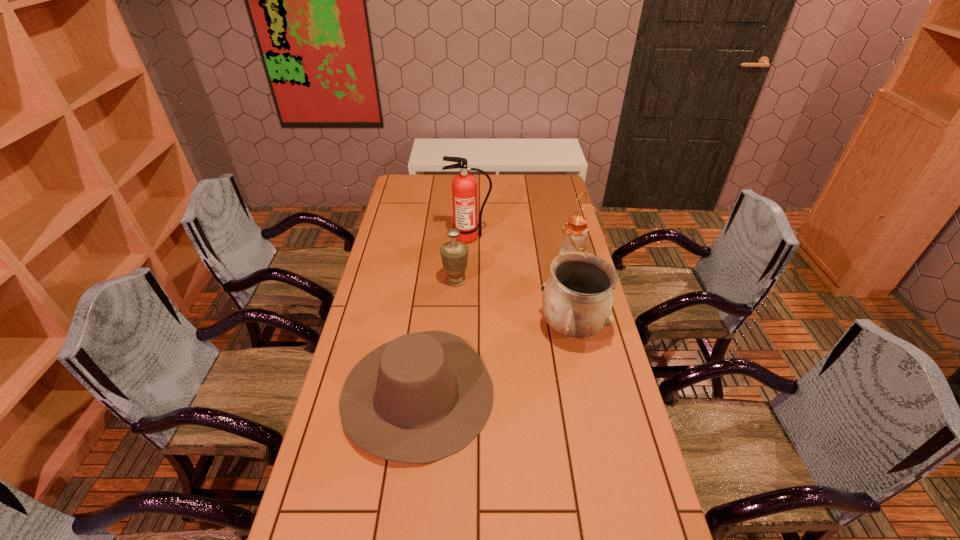
The width and height of the screenshot is (960, 540). In order to click on object that is positioned at the left edge in this screenshot , I will do `click(422, 397)`.

Locate an element on the screen. The width and height of the screenshot is (960, 540). oil lamp located at the right edge is located at coordinates (574, 233).

Identify the location of urn present at the right edge. (577, 301).

Image resolution: width=960 pixels, height=540 pixels. I want to click on vacant area at the far edge of the desktop, so click(x=492, y=177).

This screenshot has height=540, width=960. In the image, there is a desktop. Find the location of `vacant space at the left edge`. vacant space at the left edge is located at coordinates (401, 266).

In the image, there is a desktop. Where is `vacant space at the right edge`? The image size is (960, 540). vacant space at the right edge is located at coordinates (549, 255).

You are a GUI agent. You are given a task and a screenshot of the screen. Output one action in this format:
    pyautogui.click(x=<x>, y=<y>)
    Task: Click on the vacant region at the far right corner of the desktop
    This screenshot has width=960, height=540.
    Given the screenshot: What is the action you would take?
    pyautogui.click(x=546, y=192)

Find the location of a particular element. The height and width of the screenshot is (540, 960). free space between the fire extinguisher and the right urn is located at coordinates (520, 282).

Locate an element on the screen. This screenshot has height=540, width=960. free space between the cowboy hat and the farthest object is located at coordinates (444, 315).

You are a GUI agent. You are given a task and a screenshot of the screen. Output one action in this format:
    pyautogui.click(x=<x>, y=<y>)
    Task: Click on the empty space between the second tallest object and the cowboy hat
    This screenshot has width=960, height=540.
    Given the screenshot: What is the action you would take?
    pyautogui.click(x=494, y=328)